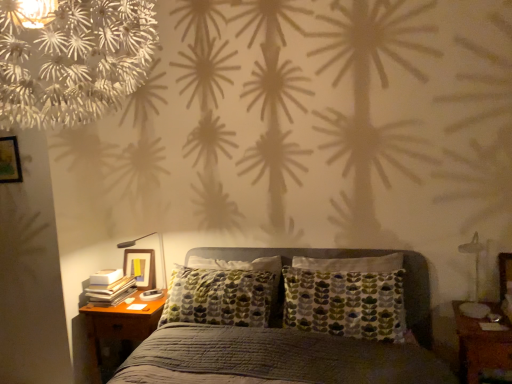
Question: Is brown wooden nightstand at lower right, which ranks as the second nightstand in back-to-front order, facing away from matte black lamp at left, the 1th bedside lamp in the back-to-front sequence?

Choices:
 (A) no
 (B) yes

Answer: (A)

Question: Does brown wooden nightstand at lower right, the second nightstand when ordered from left to right, come behind matte black lamp at left, the 1th bedside lamp in the back-to-front sequence?

Choices:
 (A) no
 (B) yes

Answer: (A)

Question: From the image's perspective, is brown wooden nightstand at lower right, the second nightstand when ordered from left to right, located beneath matte black lamp at left, which ranks as the 2th bedside lamp in front-to-back order?

Choices:
 (A) no
 (B) yes

Answer: (B)

Question: From a real-world perspective, is brown wooden nightstand at lower right, which ranks as the second nightstand in back-to-front order, physically above matte black lamp at left, which is the first bedside lamp from left to right?

Choices:
 (A) yes
 (B) no

Answer: (B)

Question: From a real-world perspective, is brown wooden nightstand at lower right, the first nightstand positioned from the front, beneath matte black lamp at left, the 2th bedside lamp in the right-to-left sequence?

Choices:
 (A) no
 (B) yes

Answer: (B)

Question: Is point (343, 382) closer or farther from the camera than point (5, 145)?

Choices:
 (A) closer
 (B) farther

Answer: (A)

Question: Is textured gray bed at center bigger or smaller than wooden picture frame at upper left?

Choices:
 (A) small
 (B) big

Answer: (B)

Question: In terms of height, does textured gray bed at center look taller or shorter compared to wooden picture frame at upper left?

Choices:
 (A) tall
 (B) short

Answer: (A)

Question: Is textured gray bed at center inside the boundaries of wooden picture frame at upper left, or outside?

Choices:
 (A) outside
 (B) inside

Answer: (A)

Question: Relative to matte black lamp at left, the 1th bedside lamp in the back-to-front sequence, is brown wooden nightstand at lower right, the first nightstand positioned from the front, in front or behind?

Choices:
 (A) front
 (B) behind

Answer: (A)

Question: Based on their sizes in the image, would you say brown wooden nightstand at lower right, which ranks as the second nightstand in back-to-front order, is bigger or smaller than matte black lamp at left, which ranks as the 2th bedside lamp in front-to-back order?

Choices:
 (A) small
 (B) big

Answer: (B)

Question: From the image's perspective, relative to matte black lamp at left, which ranks as the 2th bedside lamp in front-to-back order, is brown wooden nightstand at lower right, the first nightstand positioned from the right, above or below?

Choices:
 (A) below
 (B) above

Answer: (A)

Question: Considering the relative positions of brown wooden nightstand at lower right, the second nightstand when ordered from left to right, and matte black lamp at left, the 1th bedside lamp in the back-to-front sequence, in the image provided, is brown wooden nightstand at lower right, the second nightstand when ordered from left to right, to the left or to the right of matte black lamp at left, the 1th bedside lamp in the back-to-front sequence,?

Choices:
 (A) left
 (B) right

Answer: (B)

Question: From a real-world perspective, relative to brown wooden nightstand at lower right, the first nightstand positioned from the front, is metallic silver bedside lamp at right, the 1th bedside lamp when ordered from front to back, vertically above or below?

Choices:
 (A) above
 (B) below

Answer: (A)

Question: In the image, is metallic silver bedside lamp at right, positioned as the 1th bedside lamp in right-to-left order, on the left side or the right side of brown wooden nightstand at lower right, which ranks as the second nightstand in back-to-front order?

Choices:
 (A) left
 (B) right

Answer: (A)